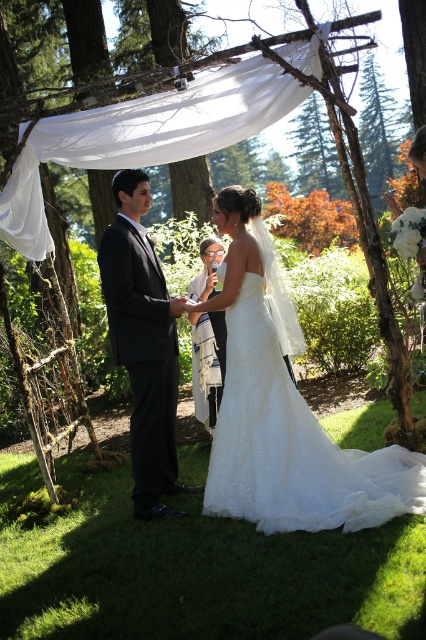
Which is more to the right, white lace wedding dress at center or black satin suit at center?

white lace wedding dress at center is more to the right.

Can you confirm if white lace wedding dress at center is bigger than black satin suit at center?

Indeed, white lace wedding dress at center has a larger size compared to black satin suit at center.

Between point (350, 456) and point (155, 426), which one is positioned in front?

Point (155, 426) is in front.

Locate an element on the screen. The height and width of the screenshot is (640, 426). white lace wedding dress at center is located at coordinates (293, 444).